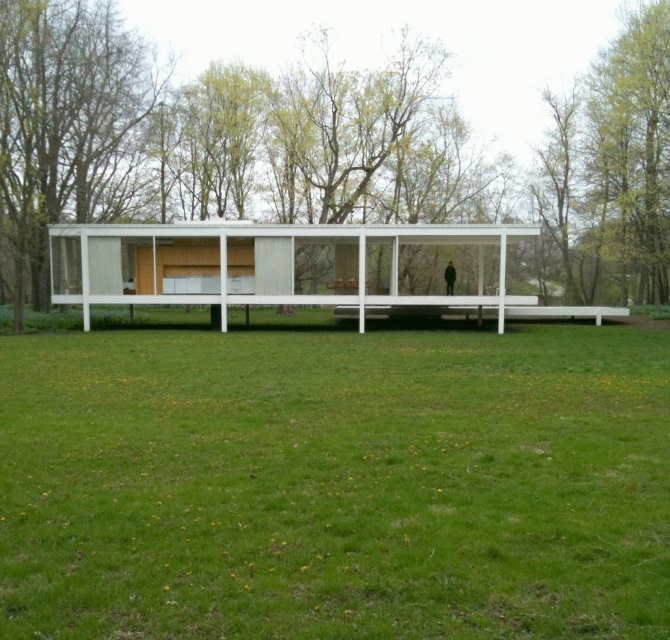
Is green grass at lower center smaller than green leafy tree at left?

Yes.

Who is positioned more to the right, green grass at lower center or green leafy tree at left?

From the viewer's perspective, green grass at lower center appears more on the right side.

Does point (94, 557) lie behind point (1, 67)?

No, (94, 557) is closer to viewer.

Find the location of `green grass at lower center`. green grass at lower center is located at coordinates (335, 483).

Is green grass at lower center to the left of green leafy tree at center from the viewer's perspective?

Correct, you'll find green grass at lower center to the left of green leafy tree at center.

Who is more forward, [306,400] or [54,230]?

Point [306,400]

Locate an element on the screen. The image size is (670, 640). green grass at lower center is located at coordinates (335, 483).

Is point (641, 28) farther from viewer compared to point (21, 220)?

Yes, it is.

Which is below, green leafy tree at center or green leafy tree at left?

green leafy tree at left is lower down.

At what (x,y) coordinates should I click in order to perform the action: click on green leafy tree at center. Please return your answer as a coordinate pair (x, y). The width and height of the screenshot is (670, 640). Looking at the image, I should click on (318, 179).